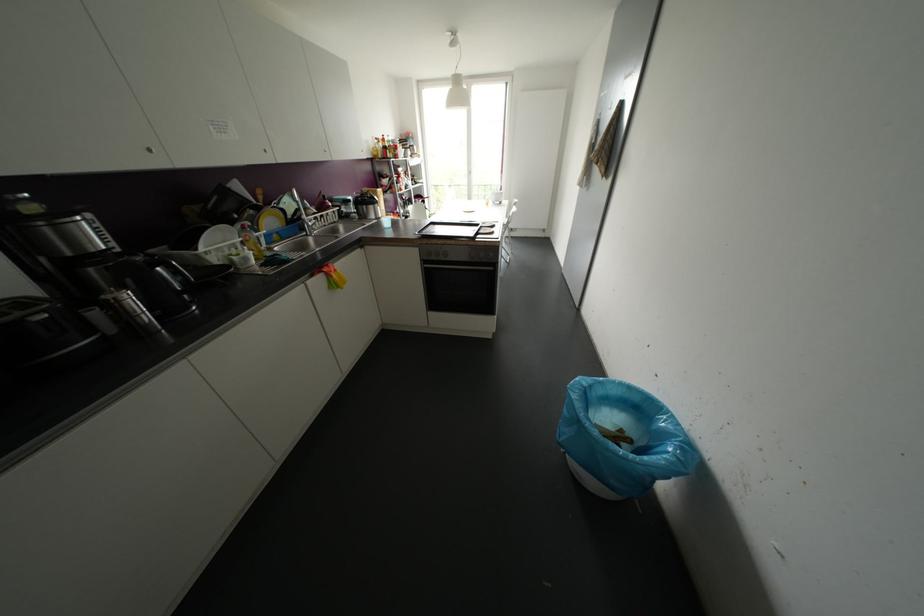
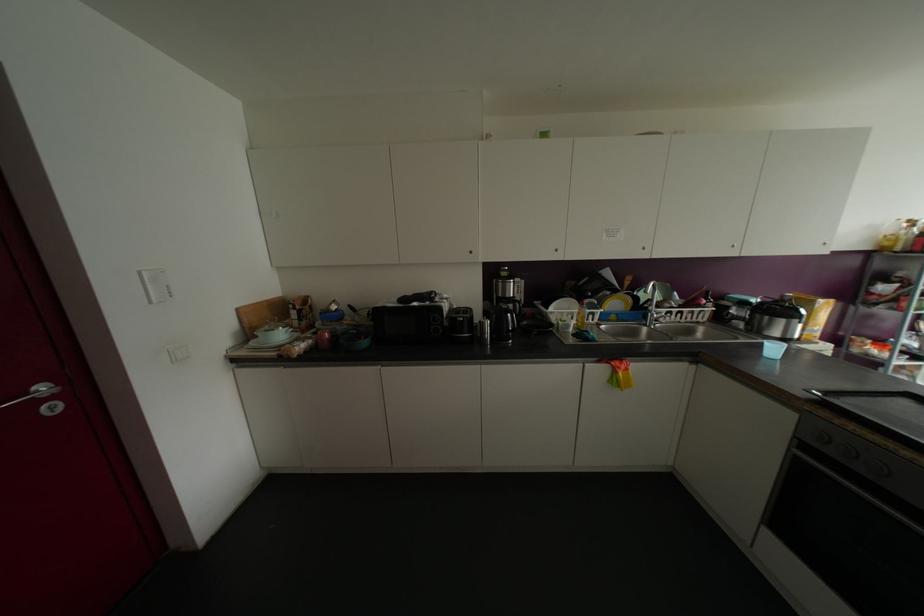
Question: The camera is either moving clockwise (left) or counter-clockwise (right) around the object. The first image is from the beginning of the video and the second image is from the end. Is the camera moving left or right when shooting the video?

Choices:
 (A) Left
 (B) Right

Answer: (B)